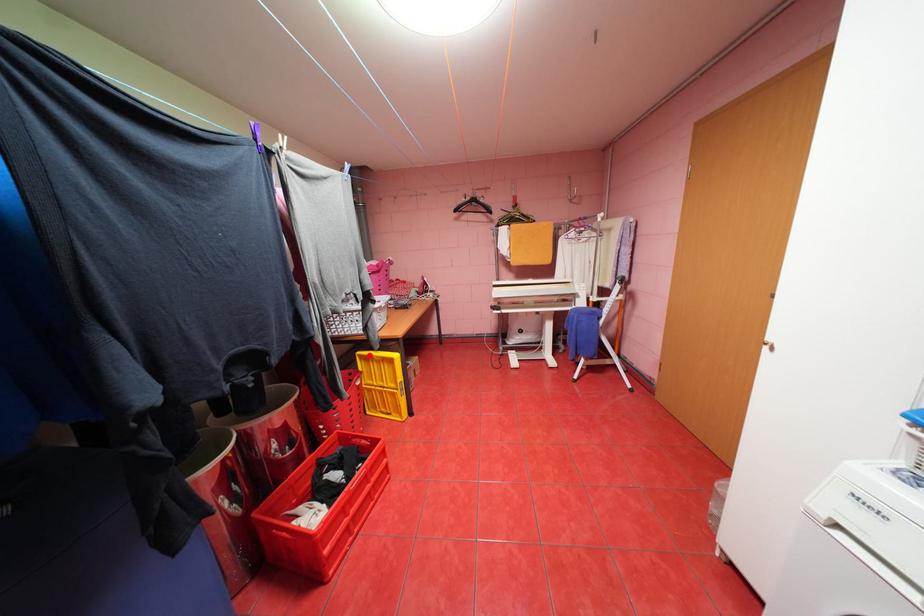
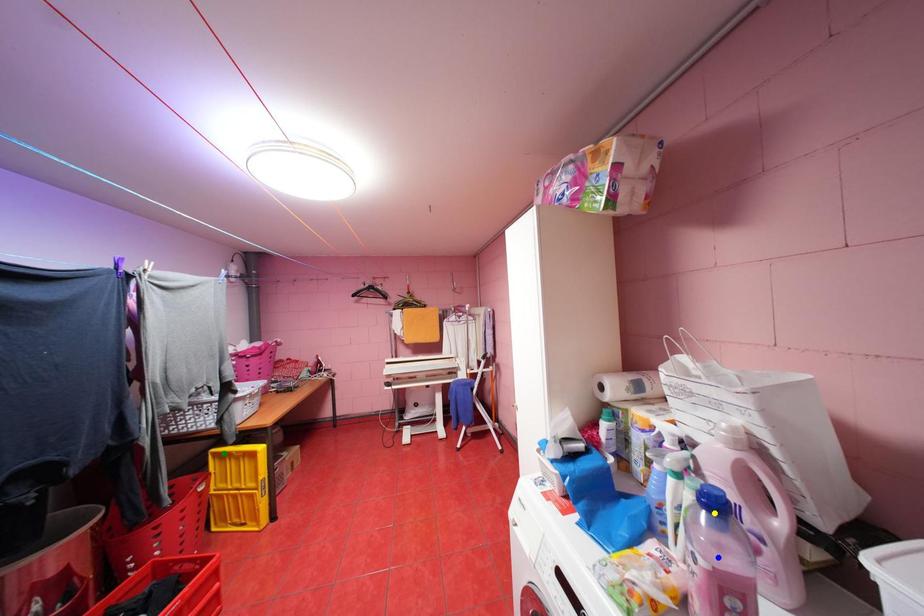
Question: I am providing you with two images of the same scene from different viewpoints. A red point is marked on the first image. You are given multiple points on the second image. Which point in image 2 represents the same 3d spot as the red point in image 1?

Choices:
 (A) green point
 (B) blue point
 (C) yellow point

Answer: (A)